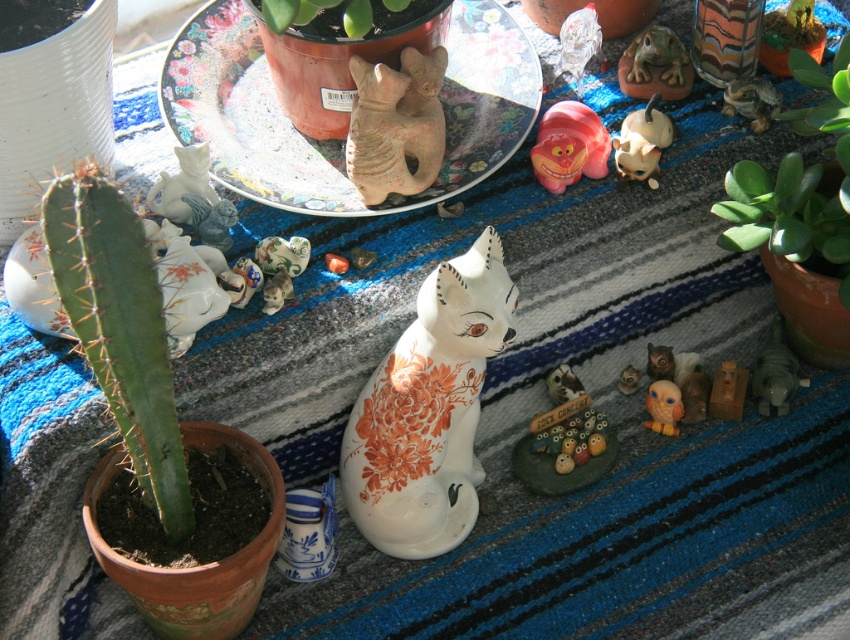
Question: Which point is closer to the camera?

Choices:
 (A) (428, 60)
 (B) (663, 413)
 (C) (666, 147)

Answer: (A)

Question: Can you confirm if white glossy ceramic cat at center is bigger than green matte plant at upper center?

Choices:
 (A) yes
 (B) no

Answer: (A)

Question: Is matte brown figurine at center further to camera compared to matte yellow bird at center right?

Choices:
 (A) no
 (B) yes

Answer: (A)

Question: Does green rubber plant at upper right have a smaller size compared to matte ceramic frog at upper right?

Choices:
 (A) no
 (B) yes

Answer: (A)

Question: Which of the following is the farthest from the observer?

Choices:
 (A) matte clay cat at center
 (B) matte ceramic frog at upper right
 (C) white glossy ceramic cat at center
 (D) rubberized plastic toy at center

Answer: (B)

Question: Considering the real-world distances, which object is closest to the white glossy ceramic cat at center?

Choices:
 (A) green matte plant at upper center
 (B) green spiky cactus at left
 (C) rubberized plastic toy at center
 (D) matte white cat at center

Answer: (B)